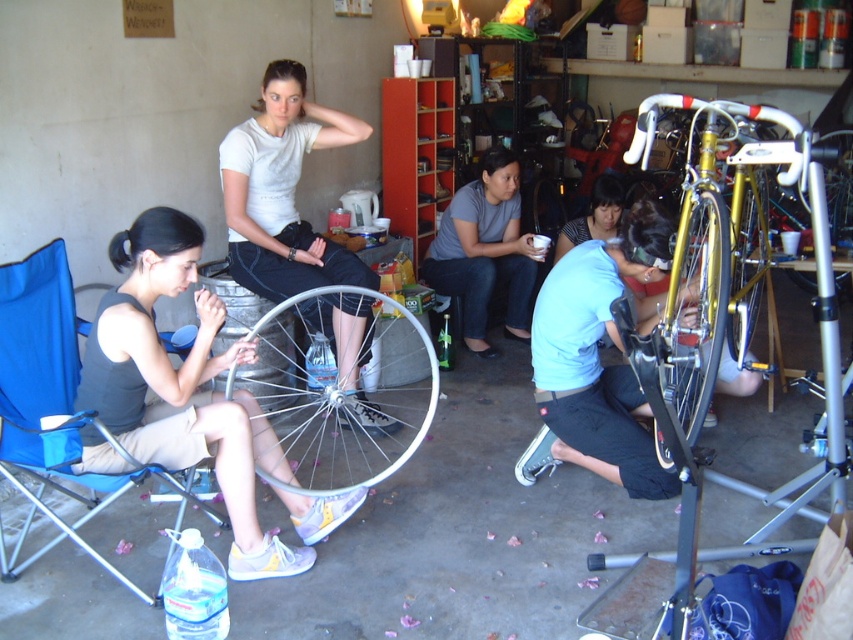
Is matte gray tank top at lower left wider than gold metallic bicycle wheel at center right?

Correct, the width of matte gray tank top at lower left exceeds that of gold metallic bicycle wheel at center right.

Which of these two, matte gray tank top at lower left or gold metallic bicycle wheel at center right, stands shorter?

gold metallic bicycle wheel at center right is shorter.

Who is more forward, (x=193, y=392) or (x=668, y=294)?

Point (x=668, y=294) is more forward.

Image resolution: width=853 pixels, height=640 pixels. Find the location of `matte gray tank top at lower left`. matte gray tank top at lower left is located at coordinates (192, 396).

Does matte gray tank top at lower left have a lesser width compared to silver metallic bicycle wheel at center?

Indeed, matte gray tank top at lower left has a lesser width compared to silver metallic bicycle wheel at center.

Between matte gray tank top at lower left and silver metallic bicycle wheel at center, which one has less height?

With less height is silver metallic bicycle wheel at center.

The image size is (853, 640). What do you see at coordinates (192, 396) in the screenshot?
I see `matte gray tank top at lower left` at bounding box center [192, 396].

Locate an element on the screen. The height and width of the screenshot is (640, 853). matte gray tank top at lower left is located at coordinates (192, 396).

Which is in front, point (706, 298) or point (521, 310)?

Point (706, 298) is more forward.

Is point (653, 385) farther from viewer compared to point (518, 326)?

No, (653, 385) is closer to viewer.

Find the location of a particular element. The height and width of the screenshot is (640, 853). gold metallic bicycle wheel at center right is located at coordinates (694, 308).